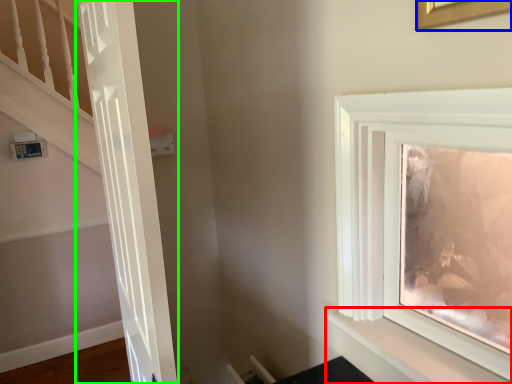
Question: Estimate the real-world distances between objects in this image. Which object is closer to shelf (highlighted by a red box), picture frame (highlighted by a blue box) or door (highlighted by a green box)?

Choices:
 (A) picture frame
 (B) door

Answer: (B)